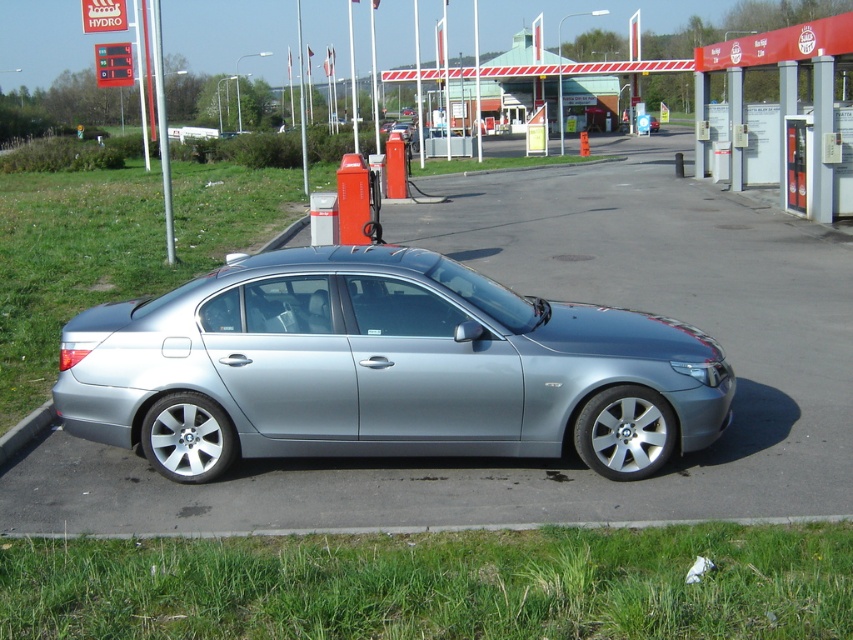
You are driving a car and want to exit the gas station. You see the satin silver car at center and the red and white striped barrier gate at center. Which object is closer to the exit if the exit is on the right side of the gas station?

The red and white striped barrier gate at center is closer to the exit because the satin silver car at center is positioned to the left of it, meaning the barrier gate is nearer to the right side exit.